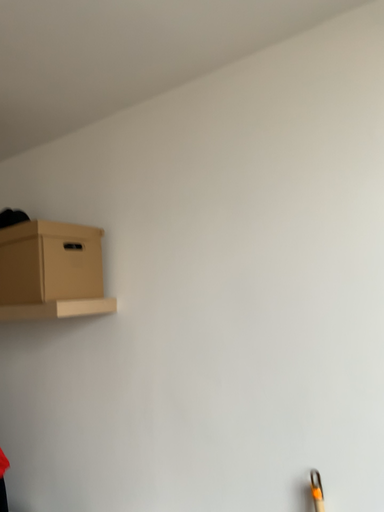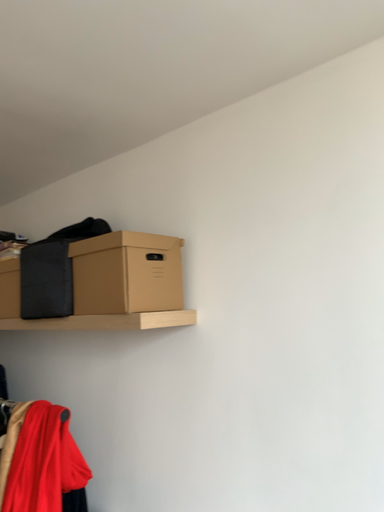
Question: Which way did the camera rotate in the video?

Choices:
 (A) rotated left
 (B) rotated right

Answer: (A)